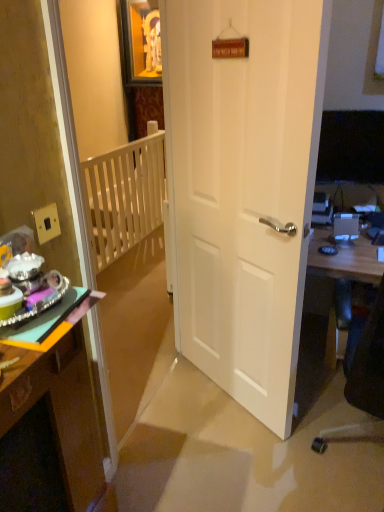
Where is `vacant area that lies in front of white matte door at center`? The image size is (384, 512). vacant area that lies in front of white matte door at center is located at coordinates (220, 448).